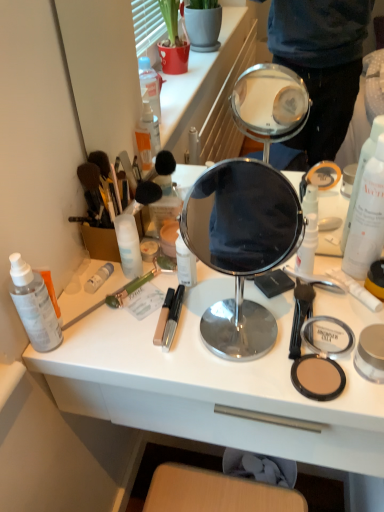
Locate an element on the screen. This screenshot has width=384, height=512. vacant space that is in between green plastic brush at lower left and white matte pump bottle at right, which ranks as the 2th toiletry in right-to-left order is located at coordinates (182, 293).